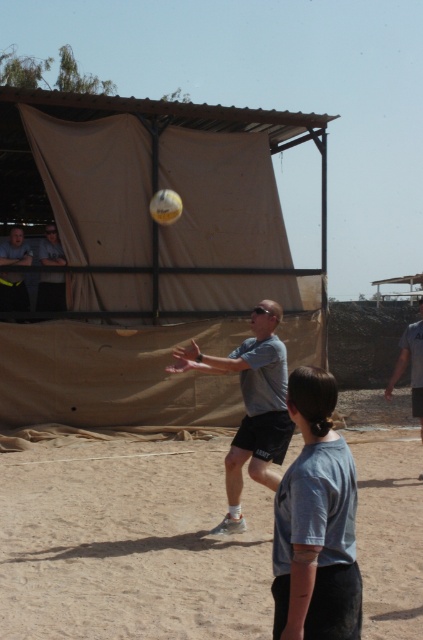
Between point (27, 252) and point (156, 211), which one is positioned in front?

Positioned in front is point (156, 211).

Does matte gray shirt at left have a lesser height compared to yellow matte volleyball at center?

No.

Which is behind, point (8, 259) or point (148, 205)?

Positioned behind is point (148, 205).

What are the coordinates of `matte gray shirt at left` in the screenshot? It's located at (13, 292).

Between brown sandy dirt at center and yellow matte volleyball at center, which one has less height?

brown sandy dirt at center is shorter.

Does brown sandy dirt at center lie behind yellow matte volleyball at center?

No, brown sandy dirt at center is closer to the viewer.

Does point (35, 513) come closer to viewer compared to point (159, 193)?

Yes, it is.

At what (x,y) coordinates should I click in order to perform the action: click on brown sandy dirt at center. Please return your answer as a coordinate pair (x, y). The width and height of the screenshot is (423, 640). Looking at the image, I should click on (129, 545).

Describe the element at coordinates (250, 404) in the screenshot. I see `gray matte shirt at center` at that location.

Who is more distant from viewer, (258,436) or (47,234)?

Point (47,234)

This screenshot has width=423, height=640. I want to click on gray matte shirt at center, so click(250, 404).